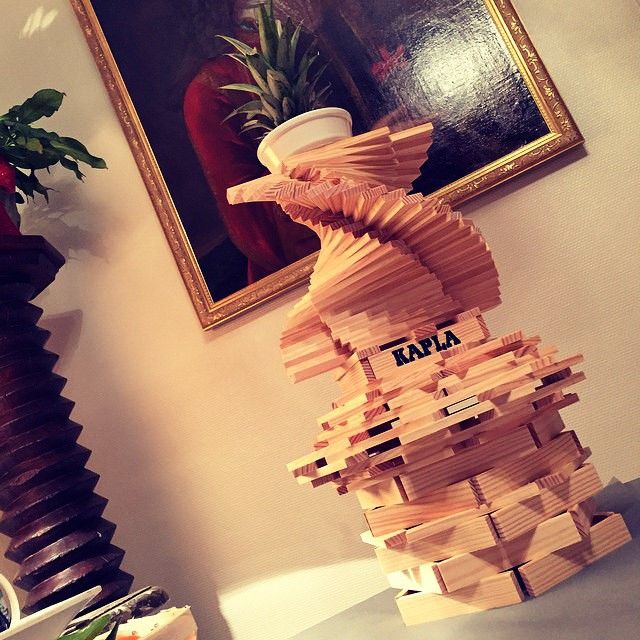
Image resolution: width=640 pixels, height=640 pixels. Find the location of `wall`. wall is located at coordinates (233, 442).